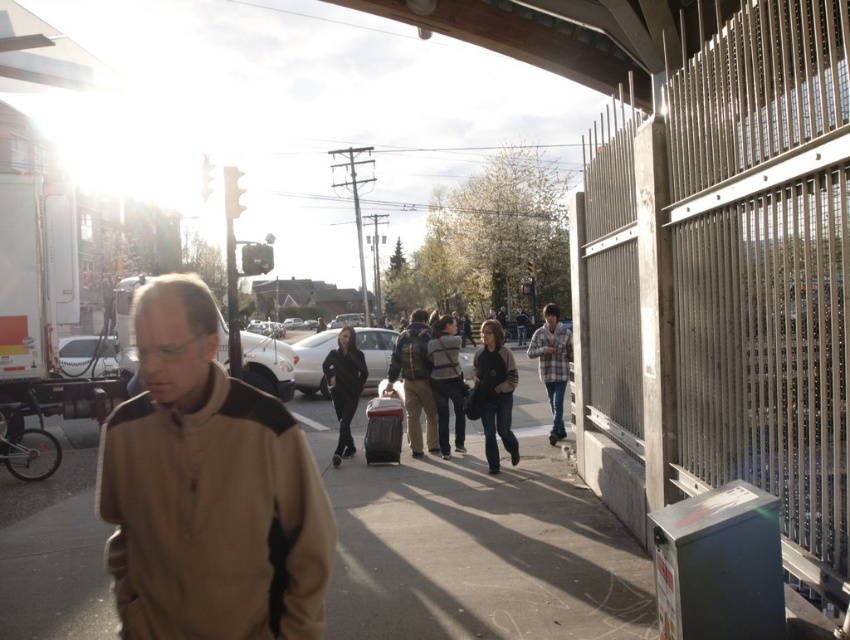
Does brown textured jacket at center have a lesser height compared to dark gray backpack at center?

Correct, brown textured jacket at center is not as tall as dark gray backpack at center.

Is point (120, 582) closer to camera compared to point (428, 353)?

That is True.

Identify the location of brown textured jacket at center. (207, 490).

Can you confirm if dark brown leather jacket at center is shorter than matte black backpack at center?

Yes.

Which is more to the right, dark brown leather jacket at center or matte black backpack at center?

From the viewer's perspective, dark brown leather jacket at center appears more on the right side.

The image size is (850, 640). Describe the element at coordinates (494, 392) in the screenshot. I see `dark brown leather jacket at center` at that location.

Image resolution: width=850 pixels, height=640 pixels. What are the coordinates of `dark brown leather jacket at center` in the screenshot? It's located at (494, 392).

Can you confirm if brown textured jacket at center is wider than black matte jacket at center?

Correct, the width of brown textured jacket at center exceeds that of black matte jacket at center.

Is brown textured jacket at center above black matte jacket at center?

Indeed, brown textured jacket at center is positioned over black matte jacket at center.

Locate an element on the screen. The width and height of the screenshot is (850, 640). brown textured jacket at center is located at coordinates (207, 490).

Locate an element on the screen. brown textured jacket at center is located at coordinates (207, 490).